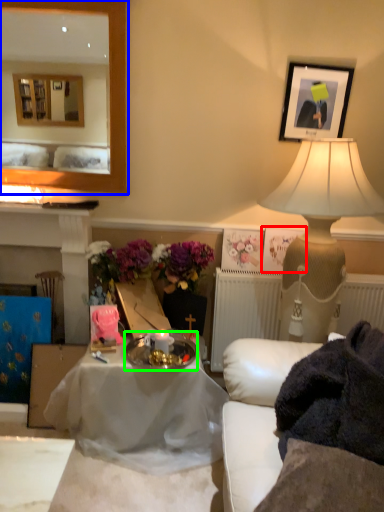
Question: Estimate the real-world distances between objects in this image. Which object is closer to picture frame (highlighted by a red box), mirror (highlighted by a blue box) or round table (highlighted by a green box)?

Choices:
 (A) mirror
 (B) round table

Answer: (B)